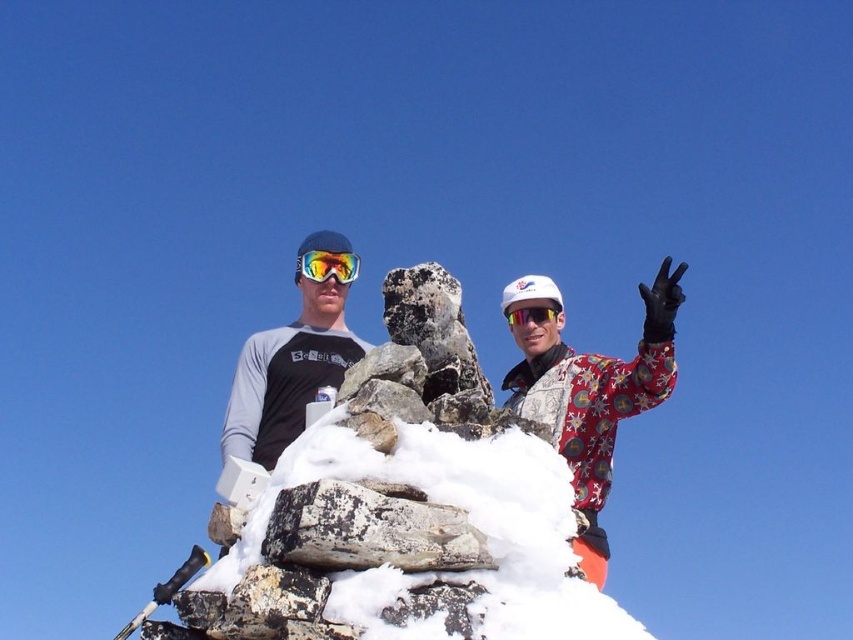
You are planning to take a photo of the white fluffy snow at center and the fluorescent red snowsuit at center. Which object should you focus on if you want the background to be slightly blurred while keeping the other in sharp focus?

To achieve a blurred background while keeping one object in focus, you should focus on the fluorescent red snowsuit at center because it is smaller in size compared to the white fluffy snow at center, allowing for a shallower depth of field.

You are a photographer trying to capture both the matte black ski goggles at center and the matte white goggles at center in a single shot. Which pair of goggles will appear closer to the camera in the photo?

The matte black ski goggles at center will appear closer to the camera because they are positioned in front of the matte white goggles at center.

You are a photographer trying to capture both the fluorescent red snowsuit at center and the speckled rock at center in a single frame. Given their sizes, which object should you focus on first to ensure both fit clearly in the photo?

Result: The fluorescent red snowsuit at center has a larger size compared to the speckled rock at center, so you should focus on the fluorescent red snowsuit at center first to ensure it fits clearly, and then adjust the framing to include the smaller speckled rock at center.